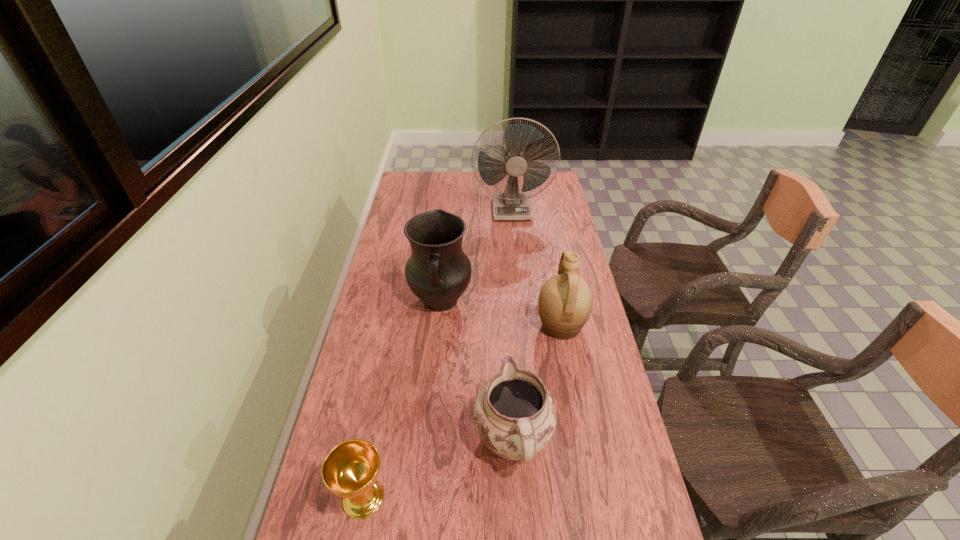
You are a GUI agent. You are given a task and a screenshot of the screen. Output one action in this format:
    pyautogui.click(x=<x>, y=<y>)
    Task: Click on the unoccupied area between the shortest pitcher and the leftmost pitcher
    Image resolution: width=960 pixels, height=540 pixels.
    Given the screenshot: What is the action you would take?
    pyautogui.click(x=477, y=371)

Identify the location of vacant point located between the tallest object and the leftmost pitcher. This screenshot has width=960, height=540. (476, 255).

Image resolution: width=960 pixels, height=540 pixels. I want to click on free point between the fan and the leftmost pitcher, so click(476, 255).

Find the location of a particular element. This screenshot has height=540, width=960. free space between the second shortest object and the leftmost pitcher is located at coordinates (477, 371).

Locate an element on the screen. The height and width of the screenshot is (540, 960). unoccupied position between the leftmost pitcher and the shortest object is located at coordinates (402, 400).

Image resolution: width=960 pixels, height=540 pixels. I want to click on object that is the nearest to the chalice, so click(514, 414).

You are a GUI agent. You are given a task and a screenshot of the screen. Output one action in this format:
    pyautogui.click(x=<x>, y=<y>)
    Task: Click on the object that ranks as the second closest to the leftmost pitcher
    
    Given the screenshot: What is the action you would take?
    pyautogui.click(x=514, y=414)

Identify which pitcher is located as the nearest to the leftmost pitcher. Please provide its 2D coordinates. Your answer should be formatted as a tuple, i.e. [(x, y)], where the tuple contains the x and y coordinates of a point satisfying the conditions above.

[(565, 301)]

I want to click on the third closest pitcher to the shortest object, so click(x=565, y=301).